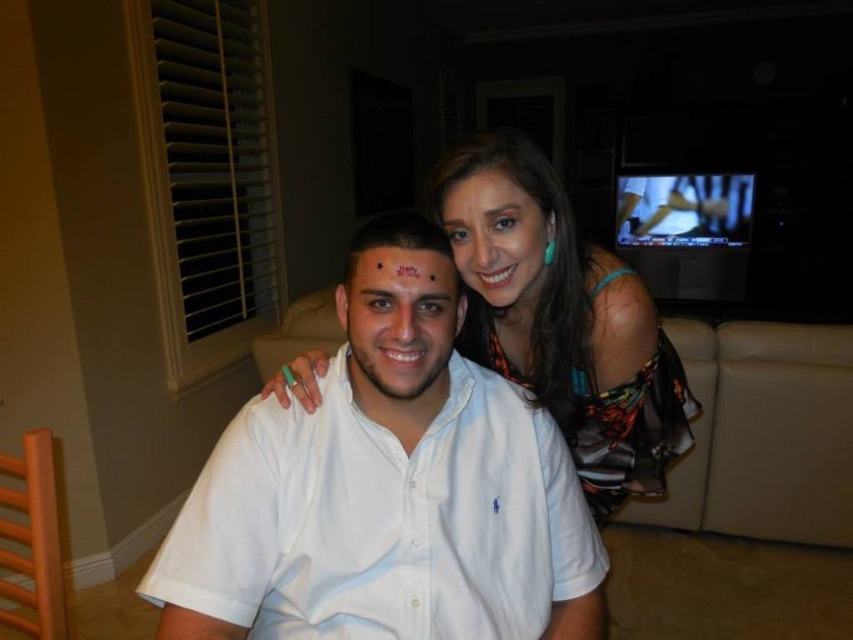
Between white cotton shirt at center and white matte shirt at center, which one has less height?

With less height is white matte shirt at center.

Find the location of a particular element. The image size is (853, 640). white cotton shirt at center is located at coordinates (386, 500).

Which is in front, point (437, 339) or point (549, 236)?

Point (437, 339) is in front.

Is white matte shirt at center to the left of matte black hair at upper center from the viewer's perspective?

Indeed, white matte shirt at center is positioned on the left side of matte black hair at upper center.

Locate an element on the screen. white matte shirt at center is located at coordinates (399, 321).

Where is `white matte shirt at center`? The width and height of the screenshot is (853, 640). white matte shirt at center is located at coordinates (399, 321).

Can you confirm if multicolored sheer dress at upper right is positioned to the right of matte black forehead at center?

Indeed, multicolored sheer dress at upper right is positioned on the right side of matte black forehead at center.

Is the position of multicolored sheer dress at upper right less distant than that of matte black forehead at center?

No, it is not.

Where is `multicolored sheer dress at upper right`? This screenshot has width=853, height=640. multicolored sheer dress at upper right is located at coordinates (561, 317).